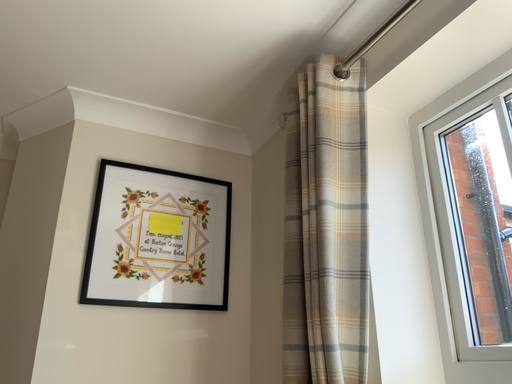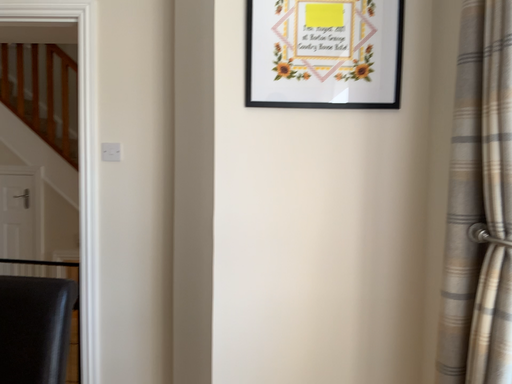
Question: Which way did the camera rotate in the video?

Choices:
 (A) rotated upward
 (B) rotated downward

Answer: (B)